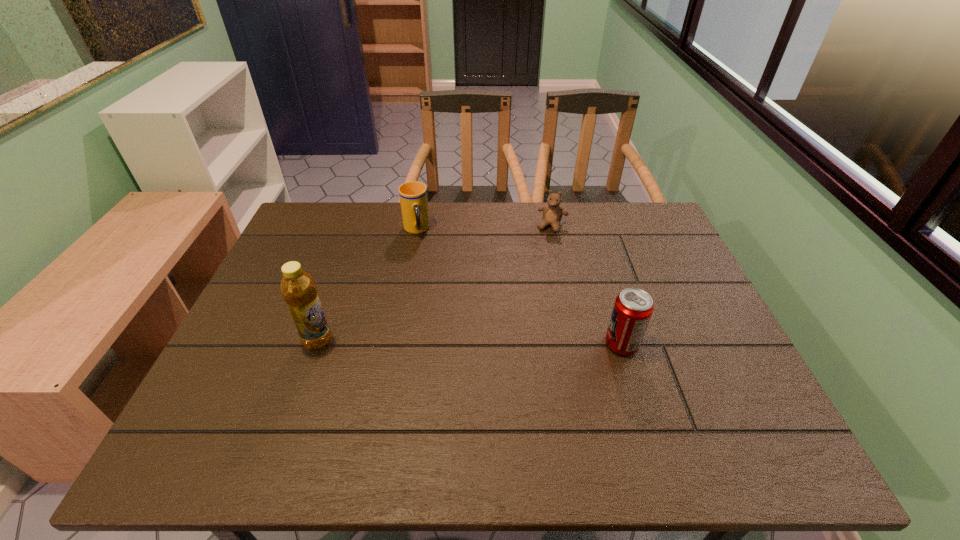
Find the location of `free space on the desktop that is between the bottle and the soda can and is positioned on the side of the third object from right to left with the handle`. free space on the desktop that is between the bottle and the soda can and is positioned on the side of the third object from right to left with the handle is located at coordinates (446, 342).

The height and width of the screenshot is (540, 960). I want to click on vacant spot on the desktop that is between the bottle and the soda can and is positioned on the front-facing side of the teddy bear, so click(513, 343).